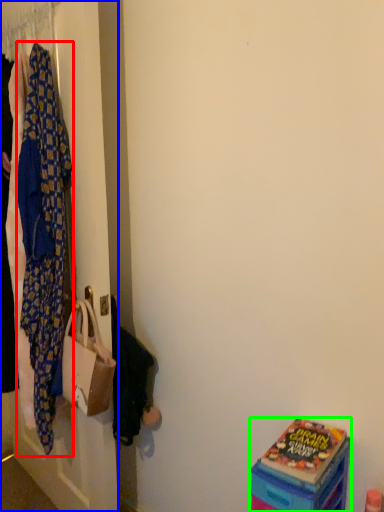
Question: Which is nearer to the blanket (highlighted by a red box)? closet (highlighted by a blue box) or box (highlighted by a green box).

Choices:
 (A) closet
 (B) box

Answer: (A)